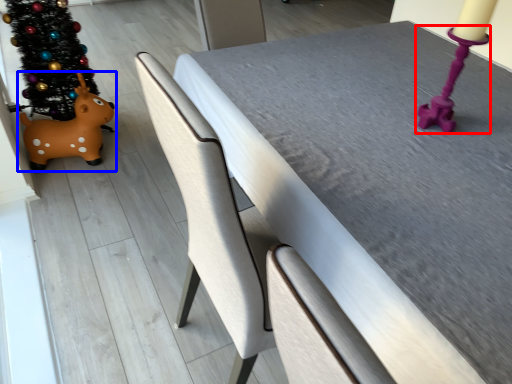
Question: Which of the following is the farthest to the observer, candle holder (highlighted by a red box) or toy (highlighted by a blue box)?

Choices:
 (A) candle holder
 (B) toy

Answer: (B)